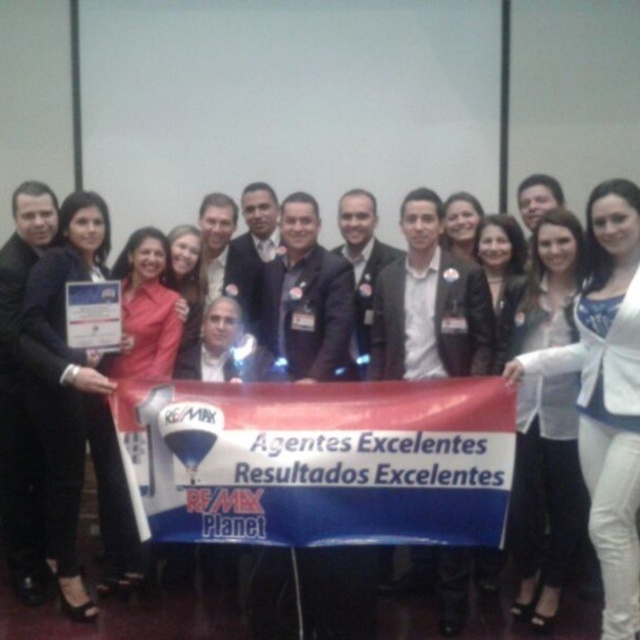
Question: Is blue fabric banner at center bigger than white glossy shirt at center?

Choices:
 (A) yes
 (B) no

Answer: (B)

Question: Which point is closer to the camera taking this photo?

Choices:
 (A) (138, 417)
 (B) (182, 616)
 (C) (612, 621)

Answer: (C)

Question: Can you confirm if blue fabric banner at center is positioned below white glossy blazer at center?

Choices:
 (A) yes
 (B) no

Answer: (A)

Question: Which point is farther to the camera?

Choices:
 (A) white glossy blazer at center
 (B) white glossy shirt at center
 (C) blue fabric banner at center

Answer: (B)

Question: Among these points, which one is nearest to the camera?

Choices:
 (A) (588, 490)
 (B) (513, 628)

Answer: (A)

Question: Is blue fabric banner at center to the right of white glossy blazer at center from the viewer's perspective?

Choices:
 (A) no
 (B) yes

Answer: (A)